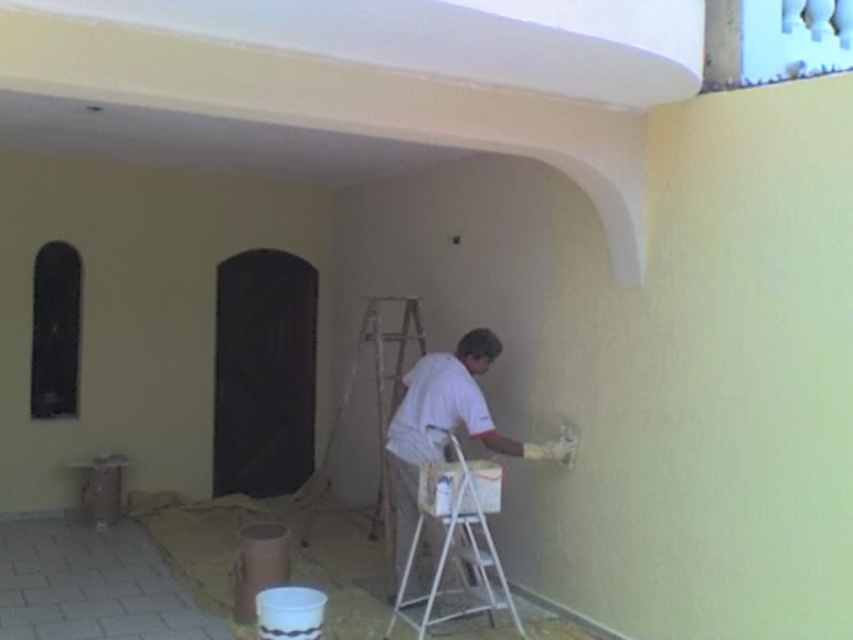
Does white matte shirt at center appear under metallic silver ladder at center?

Yes, white matte shirt at center is below metallic silver ladder at center.

Can you confirm if white matte shirt at center is bigger than metallic silver ladder at center?

No, white matte shirt at center is not bigger than metallic silver ladder at center.

Which is in front, point (415, 451) or point (395, 360)?

Point (415, 451) is more forward.

Find the location of a particular element. The width and height of the screenshot is (853, 640). white matte shirt at center is located at coordinates (445, 426).

Who is lower down, white metallic ladder at center or metallic silver ladder at center?

white metallic ladder at center

Where is `white metallic ladder at center`? white metallic ladder at center is located at coordinates (457, 536).

Between white matte shirt at center and white metallic ladder at center, which one has more height?

white matte shirt at center

Is white matte shirt at center above white metallic ladder at center?

Indeed, white matte shirt at center is positioned over white metallic ladder at center.

What do you see at coordinates (445, 426) in the screenshot?
I see `white matte shirt at center` at bounding box center [445, 426].

You are a GUI agent. You are given a task and a screenshot of the screen. Output one action in this format:
    pyautogui.click(x=<x>, y=<y>)
    Task: Click on the white matte shirt at center
    The width and height of the screenshot is (853, 640).
    Given the screenshot: What is the action you would take?
    pyautogui.click(x=445, y=426)